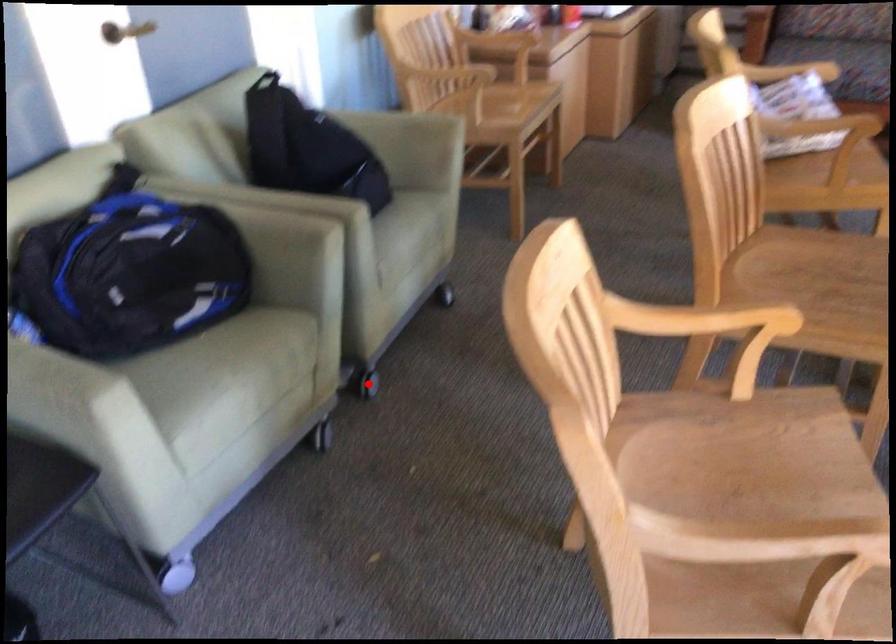
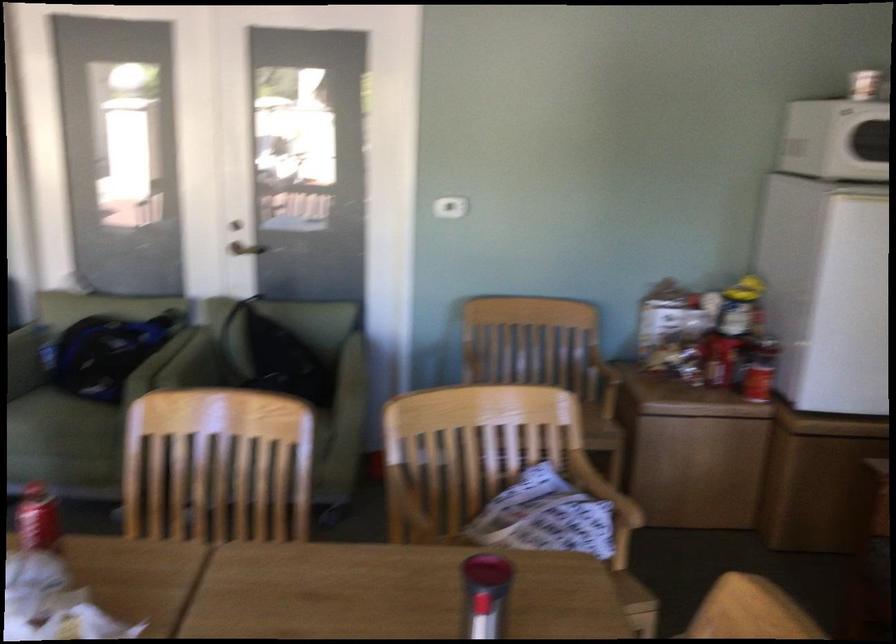
Question: I am providing you with two images of the same scene from different viewpoints. A red point is marked on the first image. Can you still see the location of the red point in image 2?

Choices:
 (A) Yes
 (B) No

Answer: (B)